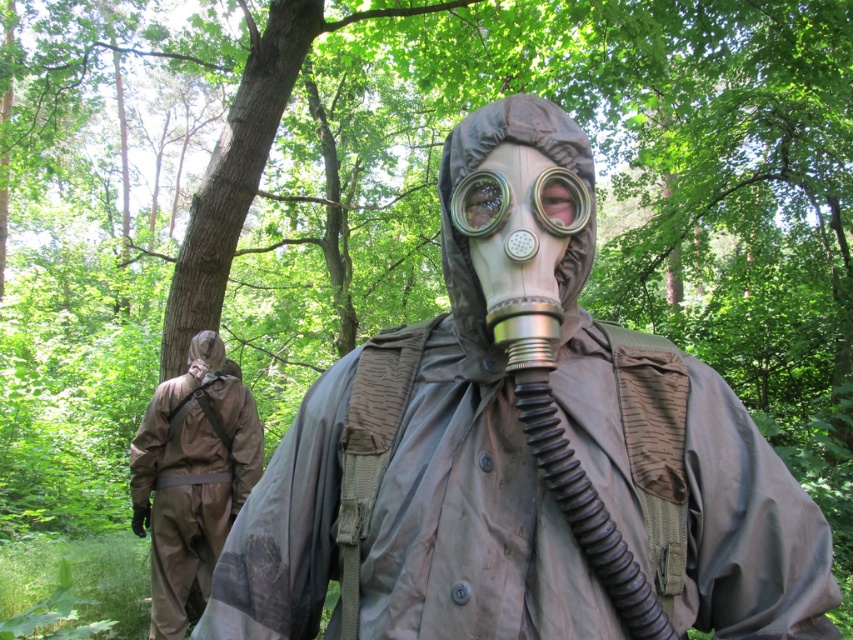
Looking at this image, does tan fabric hazmat suit at rear have a greater width compared to clear plastic goggles at center?

Correct, the width of tan fabric hazmat suit at rear exceeds that of clear plastic goggles at center.

Which is in front, point (186, 545) or point (561, 168)?

Point (561, 168)

Find the location of a particular element. The width and height of the screenshot is (853, 640). tan fabric hazmat suit at rear is located at coordinates (192, 476).

In order to click on matte khaki gas mask at center in this screenshot , I will do `click(517, 458)`.

Which is more to the right, matte khaki gas mask at center or clear plastic goggles at center?

clear plastic goggles at center is more to the right.

Is point (473, 452) positioned behind point (474, 205)?

Yes, point (473, 452) is farther from viewer.

The image size is (853, 640). I want to click on matte khaki gas mask at center, so click(x=517, y=458).

Is matte khaki gas mask at center bigger than tan fabric hazmat suit at rear?

Actually, matte khaki gas mask at center might be smaller than tan fabric hazmat suit at rear.

Does matte khaki gas mask at center appear on the right side of tan fabric hazmat suit at rear?

Indeed, matte khaki gas mask at center is positioned on the right side of tan fabric hazmat suit at rear.

Locate an element on the screen. This screenshot has width=853, height=640. matte khaki gas mask at center is located at coordinates (517, 458).